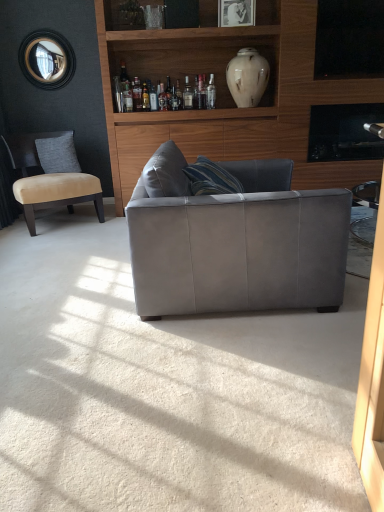
Question: Based on their sizes in the image, would you say translucent glass bottle at upper center, the 2th bottle when ordered from left to right, is bigger or smaller than beige fabric chair at left?

Choices:
 (A) big
 (B) small

Answer: (B)

Question: Which is correct: translucent glass bottle at upper center, the 2th bottle when ordered from left to right, is inside beige fabric chair at left, or outside of it?

Choices:
 (A) inside
 (B) outside

Answer: (B)

Question: Estimate the real-world distances between objects in this image. Which object is farther from the black glass window screen at upper right?

Choices:
 (A) translucent glass bottle at upper center, which appears as the third bottle when viewed from the left
 (B) suede gray couch at center
 (C) gray fabric pillow at left
 (D) white marble vase at upper center
 (E) translucent glass bottle at upper center, which is counted as the second bottle, starting from the right

Answer: (C)

Question: Which is nearer to the translucent glass bottle at upper center, the 2th bottle when ordered from left to right?

Choices:
 (A) suede gray couch at center
 (B) matte white vase at upper center
 (C) white marble vase at upper center
 (D) translucent glass bottle at upper center, which appears as the third bottle when viewed from the left
 (E) black glass window screen at upper right

Answer: (D)